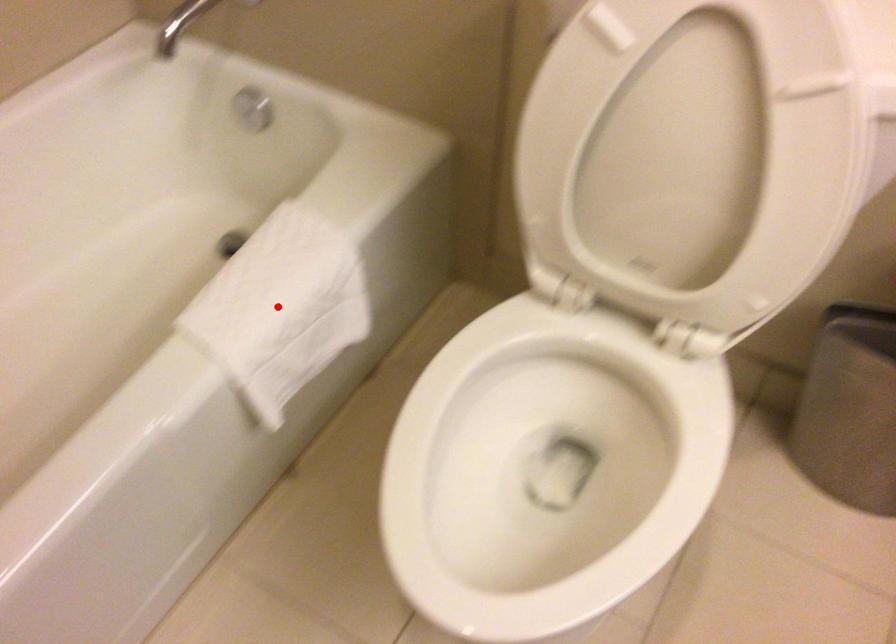
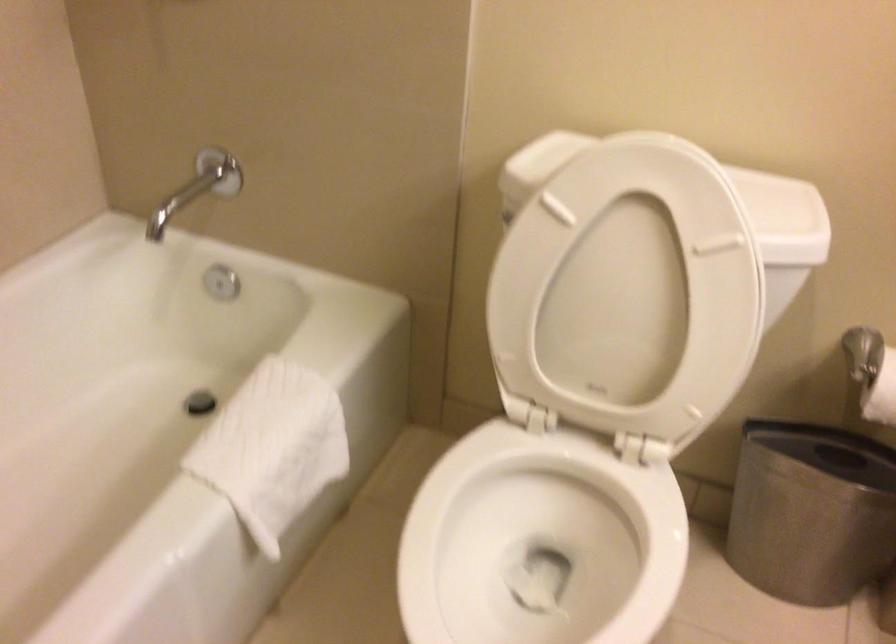
In the second image, find the point that corresponds to the highlighted location in the first image.

(272, 448)